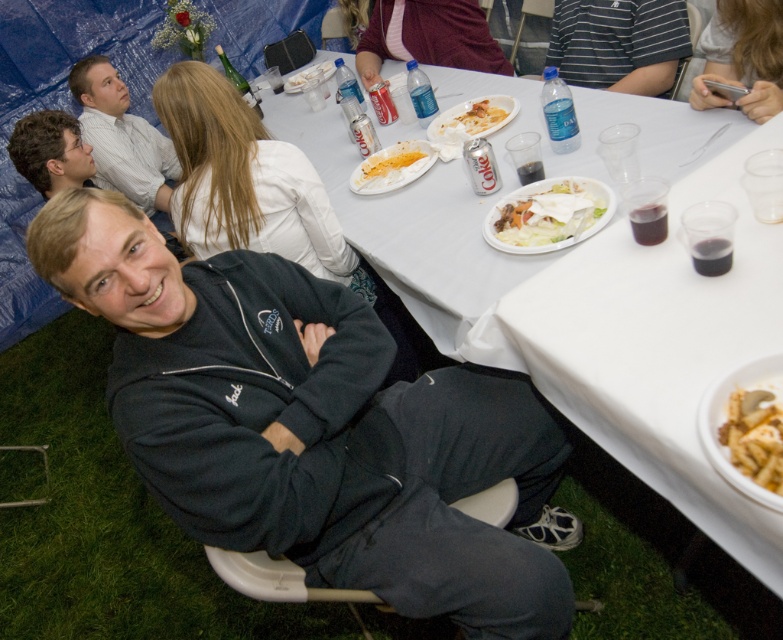
Question: Which point is farther to the camera?

Choices:
 (A) white plastic fork at upper center
 (B) silver metallic phone at upper right
 (C) white creamy pasta at center

Answer: (A)

Question: Is white plastic table at center wider than white plastic fork at upper center?

Choices:
 (A) yes
 (B) no

Answer: (A)

Question: Can you confirm if white plastic table at center is positioned above light brown shirt at upper left?

Choices:
 (A) yes
 (B) no

Answer: (B)

Question: Is dark gray sweatshirt at center below yellowish matte pasta at center?

Choices:
 (A) yes
 (B) no

Answer: (A)

Question: Which object is closer to the camera taking this photo?

Choices:
 (A) striped shirt at upper right
 (B) light brown shirt at upper left

Answer: (A)

Question: Among these objects, which one is farthest from the camera?

Choices:
 (A) white plastic fork at upper center
 (B) yellowish matte pasta at lower right
 (C) white plastic plate at upper center

Answer: (A)